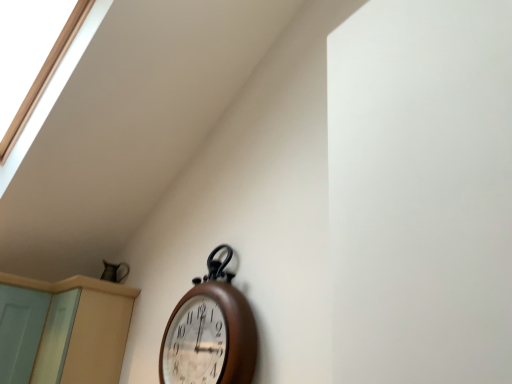
Find the location of a particular element. The height and width of the screenshot is (384, 512). wooden wall clock at center is located at coordinates (210, 332).

From the image's perspective, would you say light blue wood screen door at lower left is shown under beige wood dresser at lower left?

No, from the image's perspective, light blue wood screen door at lower left is not beneath beige wood dresser at lower left.

Can you tell me how much light blue wood screen door at lower left and beige wood dresser at lower left differ in facing direction?

The angle between the facing direction of light blue wood screen door at lower left and the facing direction of beige wood dresser at lower left is 88.6 degrees.

In the scene shown: Is light blue wood screen door at lower left to the left or to the right of beige wood dresser at lower left in the image?

In the image, light blue wood screen door at lower left appears on the left side of beige wood dresser at lower left.

In the scene shown: Is light blue wood screen door at lower left with wooden wall clock at center?

light blue wood screen door at lower left and wooden wall clock at center are clearly separated.

Considering the relative sizes of light blue wood screen door at lower left and wooden wall clock at center in the image provided, is light blue wood screen door at lower left wider than wooden wall clock at center?

Yes, light blue wood screen door at lower left is wider than wooden wall clock at center.

From the image's perspective, between light blue wood screen door at lower left and wooden wall clock at center, which one is located above?

From the image's view, wooden wall clock at center is above.

Locate an element on the screen. The height and width of the screenshot is (384, 512). wall clock on the right side of light blue wood screen door at lower left is located at coordinates (210, 332).

Would you say beige wood dresser at lower left is outside light blue wood screen door at lower left?

beige wood dresser at lower left lies outside light blue wood screen door at lower left's area.

Which is behind, beige wood dresser at lower left or light blue wood screen door at lower left?

Positioned behind is light blue wood screen door at lower left.

Is the surface of beige wood dresser at lower left in direct contact with light blue wood screen door at lower left?

No.

What's the angular difference between beige wood dresser at lower left and light blue wood screen door at lower left's facing directions?

beige wood dresser at lower left and light blue wood screen door at lower left are facing 88.6 degrees away from each other.

Would you say wooden wall clock at center is to the left or to the right of beige wood dresser at lower left in the picture?

wooden wall clock at center is to the right of beige wood dresser at lower left.

Can you confirm if wooden wall clock at center is bigger than beige wood dresser at lower left?

No.

Can you confirm if wooden wall clock at center is thinner than beige wood dresser at lower left?

Correct, the width of wooden wall clock at center is less than that of beige wood dresser at lower left.

Is there a large distance between wooden wall clock at center and light blue wood screen door at lower left?

wooden wall clock at center is far away from light blue wood screen door at lower left.

From a real-world perspective, which object stands above the other?

wooden wall clock at center.

Considering the relative positions of wooden wall clock at center and light blue wood screen door at lower left in the image provided, is wooden wall clock at center to the left or to the right of light blue wood screen door at lower left?

Clearly, wooden wall clock at center is on the right of light blue wood screen door at lower left in the image.

Locate an element on the screen. wall clock above the light blue wood screen door at lower left (from a real-world perspective) is located at coordinates (210, 332).

Is beige wood dresser at lower left not within wooden wall clock at center?

Indeed, beige wood dresser at lower left is completely outside wooden wall clock at center.

Between beige wood dresser at lower left and wooden wall clock at center, which one has more height?

Standing taller between the two is wooden wall clock at center.

Which of these two, beige wood dresser at lower left or wooden wall clock at center, is wider?

beige wood dresser at lower left.

At what (x,y) coordinates should I click in order to perform the action: click on screen door on the left side of beige wood dresser at lower left. Please return your answer as a coordinate pair (x, y). This screenshot has height=384, width=512. Looking at the image, I should click on (20, 331).

Where is `wall clock lying on the right of light blue wood screen door at lower left`? This screenshot has width=512, height=384. wall clock lying on the right of light blue wood screen door at lower left is located at coordinates (210, 332).

From the image, which object appears to be nearer to light blue wood screen door at lower left, beige wood dresser at lower left or wooden wall clock at center?

Among the two, beige wood dresser at lower left is located nearer to light blue wood screen door at lower left.

Estimate the real-world distances between objects in this image. Which object is closer to light blue wood screen door at lower left, wooden wall clock at center or beige wood dresser at lower left?

beige wood dresser at lower left.

From the image, which object appears to be nearer to wooden wall clock at center, light blue wood screen door at lower left or beige wood dresser at lower left?

beige wood dresser at lower left is closer to wooden wall clock at center.

Looking at the image, which one is located further to beige wood dresser at lower left, wooden wall clock at center or light blue wood screen door at lower left?

wooden wall clock at center.

Based on their spatial positions, is beige wood dresser at lower left or light blue wood screen door at lower left further from wooden wall clock at center?

Among the two, light blue wood screen door at lower left is located further to wooden wall clock at center.

Looking at the image, which one is located closer to beige wood dresser at lower left, light blue wood screen door at lower left or wooden wall clock at center?

light blue wood screen door at lower left lies closer to beige wood dresser at lower left than the other object.

Where is `dresser situated between light blue wood screen door at lower left and wooden wall clock at center from left to right`? This screenshot has width=512, height=384. dresser situated between light blue wood screen door at lower left and wooden wall clock at center from left to right is located at coordinates (63, 330).